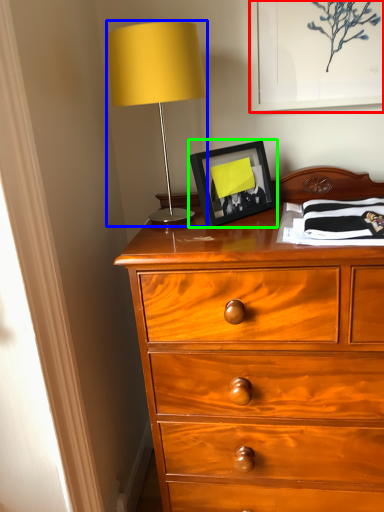
Question: Considering the real-world distances, which object is closest to picture frame (highlighted by a red box)? table lamp (highlighted by a blue box) or picture frame (highlighted by a green box).

Choices:
 (A) table lamp
 (B) picture frame

Answer: (B)